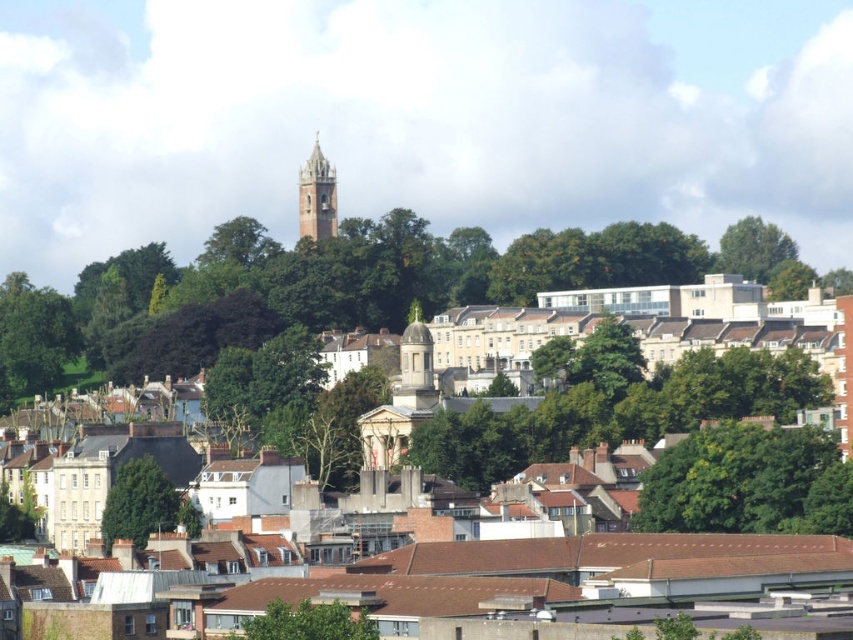
Which of these two, green leafy tree at lower left or white stone dome at center, stands shorter?

With less height is green leafy tree at lower left.

Can you confirm if green leafy tree at lower left is shorter than white stone dome at center?

Yes.

What are the coordinates of `green leafy tree at lower left` in the screenshot? It's located at (144, 502).

Does point (701, 496) come farther from viewer compared to point (320, 605)?

Yes, it is.

Does green leafy tree at center have a greater height compared to green leafy tree at lower center?

Yes.

Identify the location of green leafy tree at center. (747, 483).

Where is `green leafy tree at center`? green leafy tree at center is located at coordinates tap(747, 483).

In the scene shown: Does green leafy tree at lower center have a larger size compared to green leafy tree at upper right?

Answer: No.

Does green leafy tree at lower center appear over green leafy tree at upper right?

No.

This screenshot has height=640, width=853. What do you see at coordinates (306, 621) in the screenshot?
I see `green leafy tree at lower center` at bounding box center [306, 621].

Find the location of a particular element. This screenshot has height=640, width=853. green leafy tree at lower center is located at coordinates (306, 621).